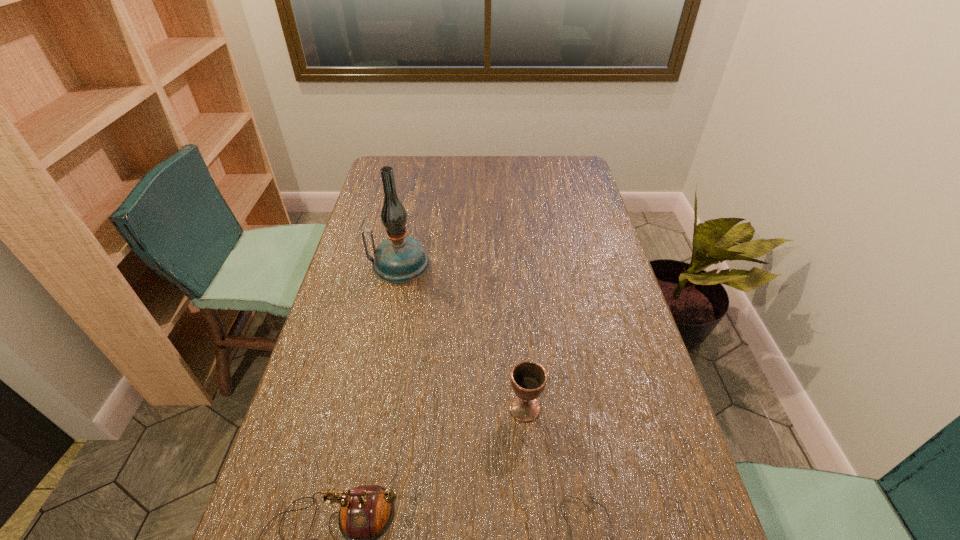
Find the location of `blank region between the farthest object and the second farthest object`. blank region between the farthest object and the second farthest object is located at coordinates (462, 336).

Identify the location of vacant space that's between the tallest object and the second tallest object. (462, 336).

Locate which object ranks third in proximity to the third shortest object. Please provide its 2D coordinates. Your answer should be formatted as a tuple, i.e. [(x, y)], where the tuple contains the x and y coordinates of a point satisfying the conditions above.

[(399, 259)]

Find the location of a particular element. This screenshot has height=540, width=960. object that is the nearest to the oil lamp is located at coordinates (528, 378).

This screenshot has width=960, height=540. Identify the location of vacant space that satisfies the following two spatial constraints: 1. on the front side of the farthest object; 2. on the right side of the chalice. (371, 408).